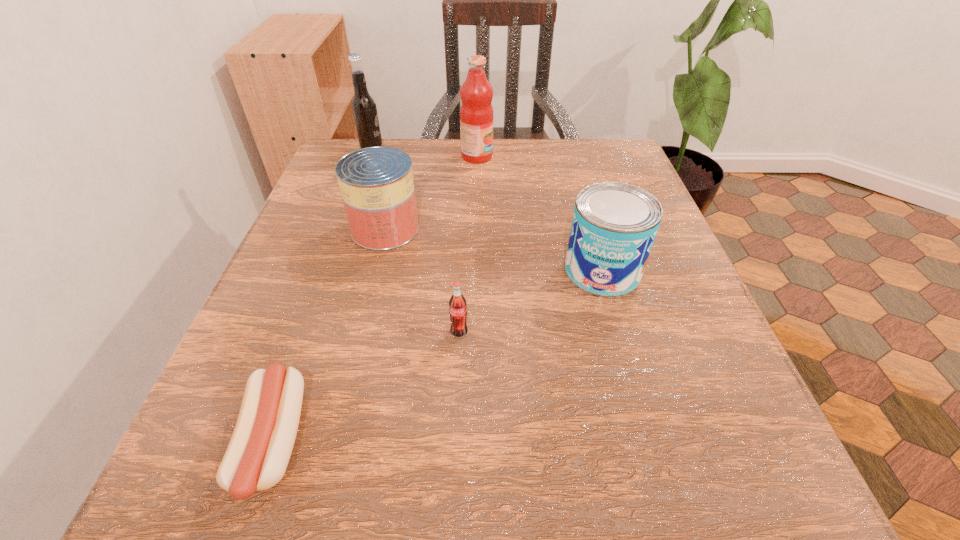
The image size is (960, 540). Find the location of `object that is at the right edge`. object that is at the right edge is located at coordinates (614, 225).

Where is `object at the far left corner`? object at the far left corner is located at coordinates (364, 109).

Where is `object that is positioned at the near left corner`? object that is positioned at the near left corner is located at coordinates (257, 456).

The width and height of the screenshot is (960, 540). What are the coordinates of `free location at the far edge` in the screenshot? It's located at (441, 151).

Identify the location of free space at the near edge. The image size is (960, 540). (540, 501).

In the image, there is a desktop. In order to click on vacant space at the left edge in this screenshot , I will do `click(352, 254)`.

Find the location of a particular element. vacant space at the far right corner is located at coordinates (627, 173).

Image resolution: width=960 pixels, height=540 pixels. I want to click on free space between the second shortest object and the left can, so click(x=422, y=280).

Where is `vacant point located between the shortest object and the soda bottle`? This screenshot has width=960, height=540. vacant point located between the shortest object and the soda bottle is located at coordinates (366, 387).

Find the location of a particular element. The height and width of the screenshot is (540, 960). vacant area between the fifth tallest object and the left can is located at coordinates (422, 280).